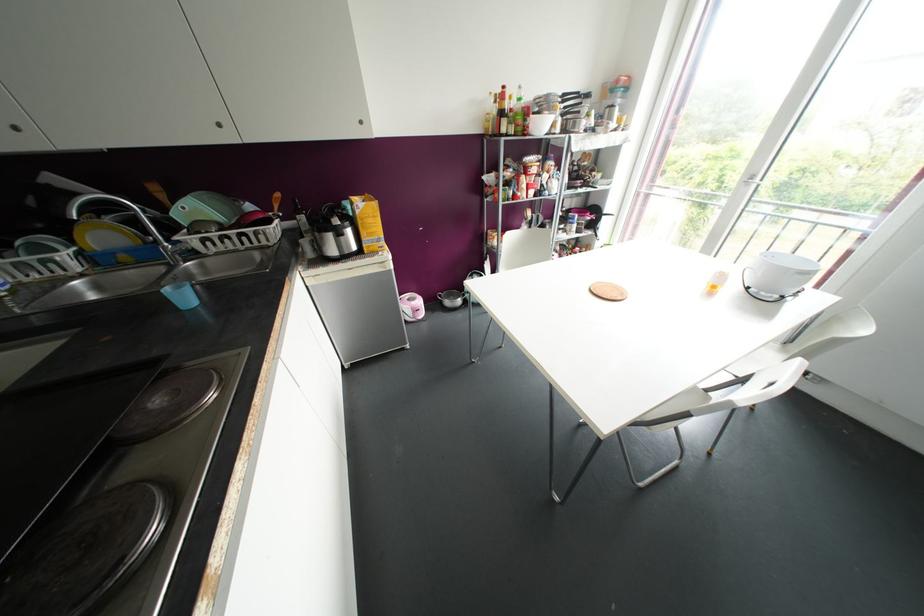
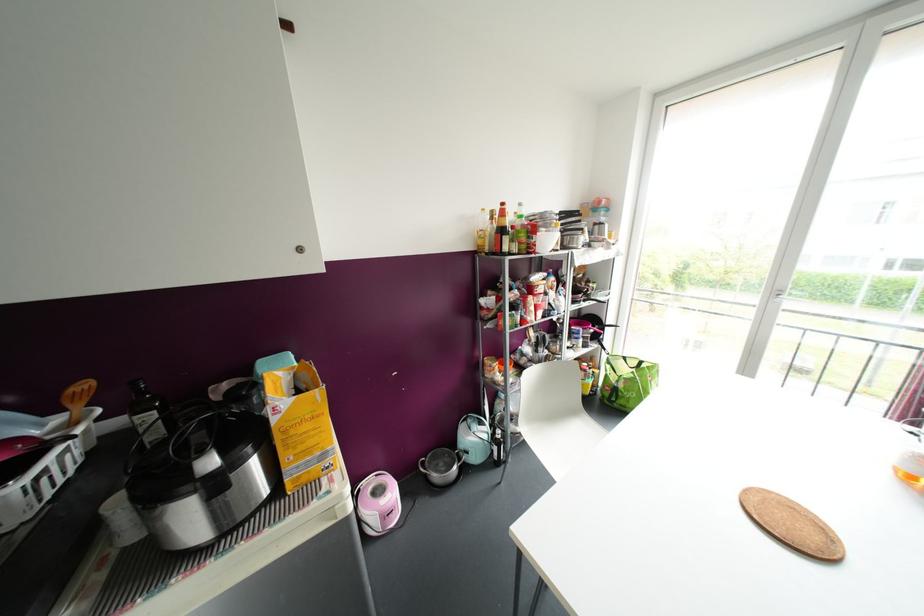
Where in the second image is the point corresponding to (419,301) from the first image?

(392, 493)